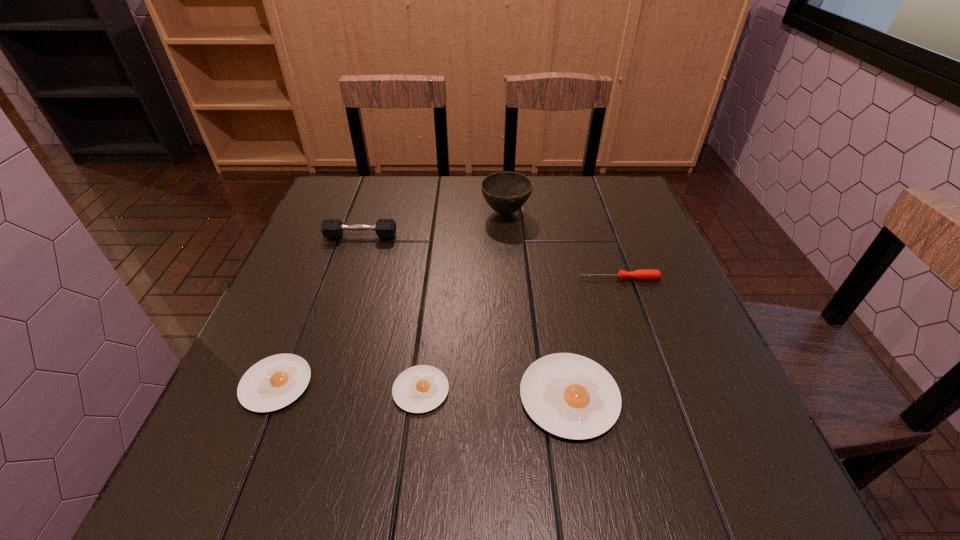
In the current image, all egg yolks are evenly spaced. To maintain this equal spacing, where should an additional egg yolk be placed on the right? Please point out a free spot. Please provide its 2D coordinates. Your answer should be formatted as a tuple, i.e. [(x, y)], where the tuple contains the x and y coordinates of a point satisfying the conditions above.

[(722, 403)]